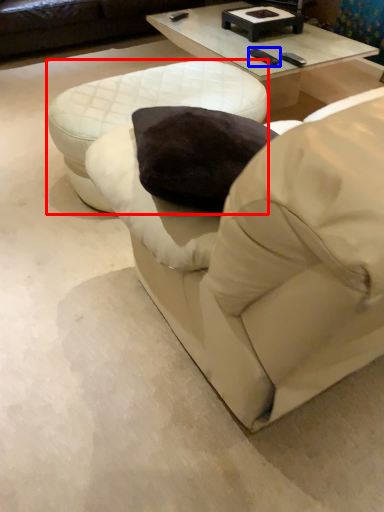
Question: Which object is further to the camera taking this photo, table (highlighted by a red box) or pad (highlighted by a blue box)?

Choices:
 (A) table
 (B) pad

Answer: (B)